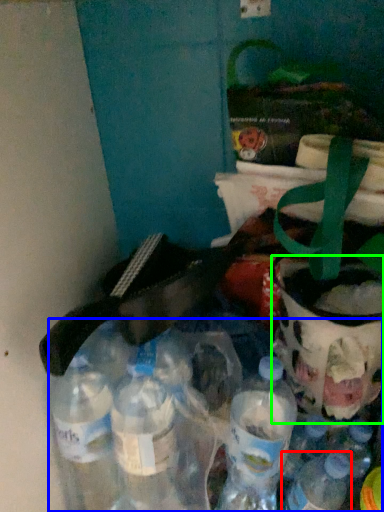
Question: Considering the real-world distances, which object is closest to bottle (highlighted by a red box)? bottle (highlighted by a blue box) or glass jar (highlighted by a green box).

Choices:
 (A) bottle
 (B) glass jar

Answer: (B)